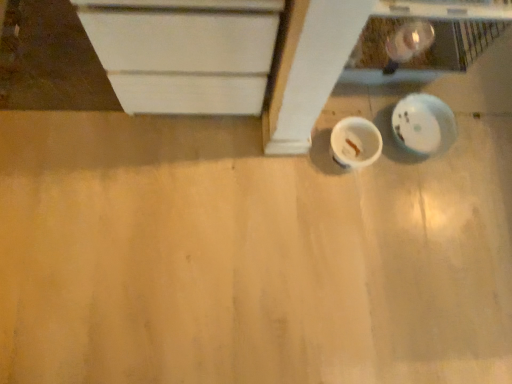
Question: From the image's perspective, is white matte cabinet at upper left positioned above or below matte white plywood at lower right?

Choices:
 (A) below
 (B) above

Answer: (B)

Question: Is white matte cabinet at upper left bigger or smaller than matte white plywood at lower right?

Choices:
 (A) small
 (B) big

Answer: (A)

Question: Which object is the farthest from the white matte cup at center?

Choices:
 (A) white matte cabinet at upper left
 (B) matte white plywood at lower right
 (C) white glossy plate at lower right

Answer: (A)

Question: Which object is the farthest from the white glossy plate at lower right?

Choices:
 (A) white matte cabinet at upper left
 (B) matte white plywood at lower right
 (C) white matte cup at center

Answer: (A)